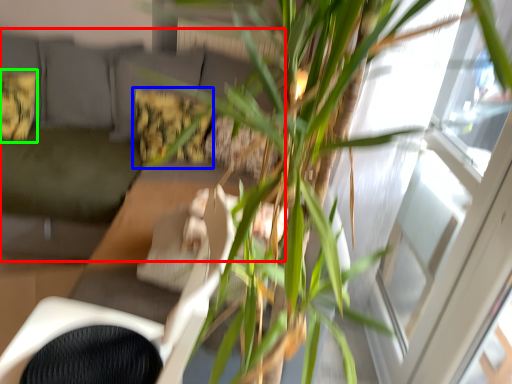
Question: Considering the real-world distances, which object is closest to couch (highlighted by a red box)? pillow (highlighted by a blue box) or pillow (highlighted by a green box).

Choices:
 (A) pillow
 (B) pillow

Answer: (B)